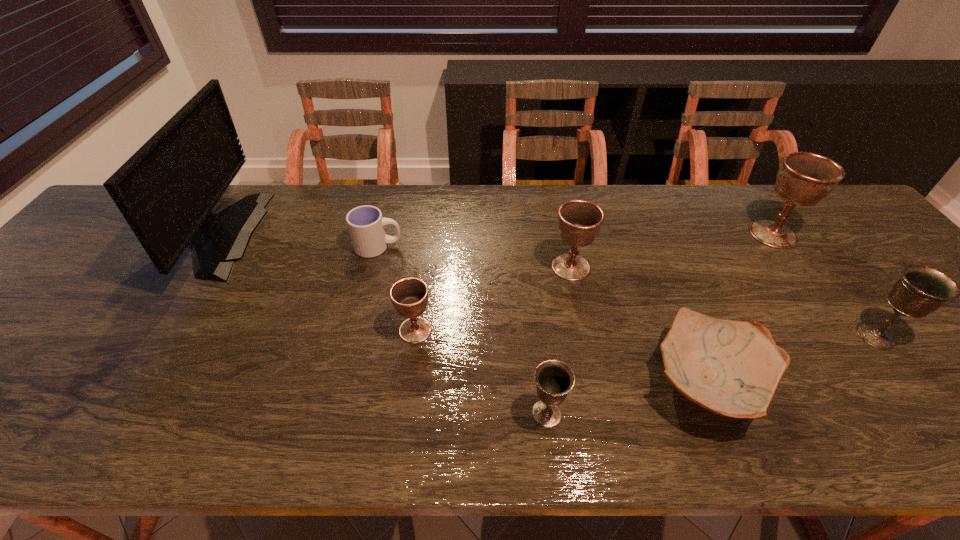
Where is `vacant area that lies between the right bronze chalice and the sixth object from right to left`? The height and width of the screenshot is (540, 960). vacant area that lies between the right bronze chalice and the sixth object from right to left is located at coordinates (645, 333).

Where is `vacant point located between the tallest chalice and the right bronze chalice`? The width and height of the screenshot is (960, 540). vacant point located between the tallest chalice and the right bronze chalice is located at coordinates (824, 285).

Find the location of `blank region between the right bronze chalice and the cup`. blank region between the right bronze chalice and the cup is located at coordinates (627, 291).

Where is `vacant area that lies between the seventh shortest object and the second farthest chalice`? Image resolution: width=960 pixels, height=540 pixels. vacant area that lies between the seventh shortest object and the second farthest chalice is located at coordinates (672, 251).

I want to click on free point between the third object from right to left and the fifth object from left to right, so click(x=638, y=325).

Find the location of a particular element. empty space that is in between the second nearest brown chalice and the right bronze chalice is located at coordinates (723, 301).

Identify the location of empty space between the pottery and the third chalice from right to left. The width and height of the screenshot is (960, 540). (638, 325).

Where is `empty space between the smaller bronze chalice and the second smallest brown chalice`? This screenshot has height=540, width=960. empty space between the smaller bronze chalice and the second smallest brown chalice is located at coordinates (559, 340).

Where is `free space between the biggest brown chalice and the pottery`? Image resolution: width=960 pixels, height=540 pixels. free space between the biggest brown chalice and the pottery is located at coordinates (739, 308).

Identify which object is located as the fourth nearest to the cup. Please provide its 2D coordinates. Your answer should be formatted as a tuple, i.e. [(x, y)], where the tuple contains the x and y coordinates of a point satisfying the conditions above.

[(554, 379)]